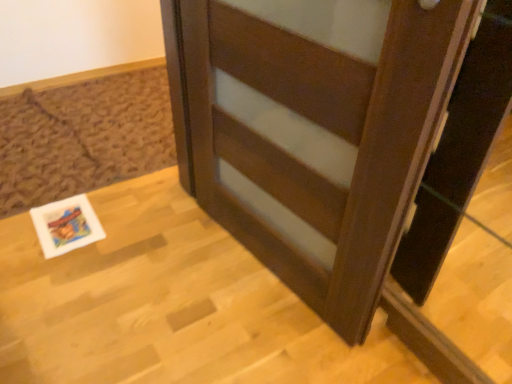
Question: Is white glossy postcard at lower left positioned behind brown wood door at center?

Choices:
 (A) no
 (B) yes

Answer: (B)

Question: Considering the relative sizes of white glossy postcard at lower left and brown wood door at center in the image provided, is white glossy postcard at lower left thinner than brown wood door at center?

Choices:
 (A) yes
 (B) no

Answer: (A)

Question: Considering the relative sizes of white glossy postcard at lower left and brown wood door at center in the image provided, is white glossy postcard at lower left shorter than brown wood door at center?

Choices:
 (A) no
 (B) yes

Answer: (B)

Question: Is white glossy postcard at lower left closer to camera compared to brown wood door at center?

Choices:
 (A) yes
 (B) no

Answer: (B)

Question: Is white glossy postcard at lower left located outside brown wood door at center?

Choices:
 (A) no
 (B) yes

Answer: (B)

Question: From a real-world perspective, is white glossy postcard at lower left on brown wood door at center?

Choices:
 (A) no
 (B) yes

Answer: (A)

Question: Could you tell me if wooden table at center is facing brown wood door at center?

Choices:
 (A) no
 (B) yes

Answer: (A)

Question: Does wooden table at center have a lesser height compared to brown wood door at center?

Choices:
 (A) no
 (B) yes

Answer: (B)

Question: Does wooden table at center have a smaller size compared to brown wood door at center?

Choices:
 (A) no
 (B) yes

Answer: (B)

Question: Can you confirm if wooden table at center is positioned to the left of brown wood door at center?

Choices:
 (A) yes
 (B) no

Answer: (A)

Question: Can you confirm if wooden table at center is bigger than brown wood door at center?

Choices:
 (A) no
 (B) yes

Answer: (A)

Question: Is brown wood door at center surrounded by wooden table at center?

Choices:
 (A) no
 (B) yes

Answer: (A)

Question: From the image's perspective, would you say wooden table at center is positioned over white glossy postcard at lower left?

Choices:
 (A) yes
 (B) no

Answer: (B)